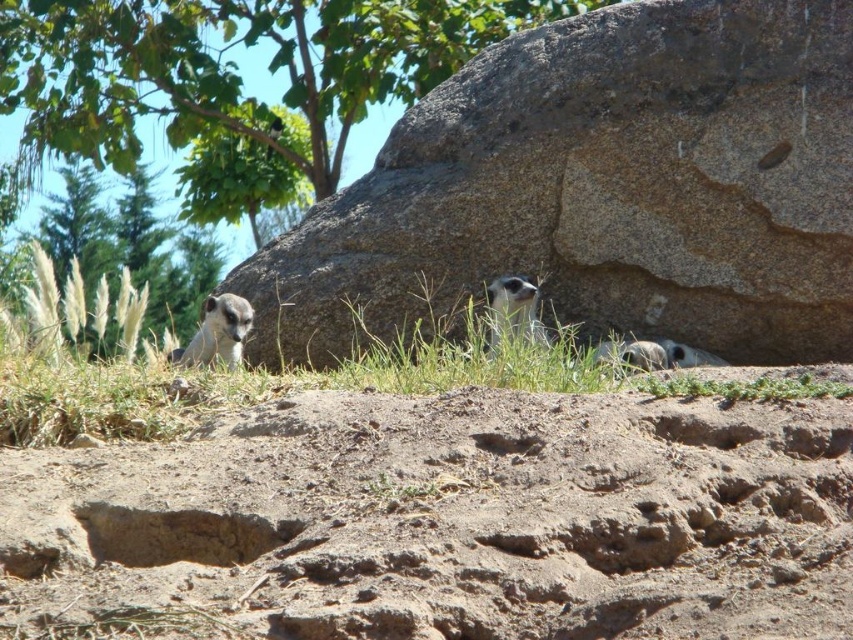
Question: Which object appears farthest from the camera in this image?

Choices:
 (A) gray rough rock at center
 (B) gray fur meerkat at left

Answer: (A)

Question: Considering the real-world distances, which object is closest to the green leafy tree at upper center?

Choices:
 (A) green leafy tree at upper left
 (B) dull brown dirt at center
 (C) green grass at center

Answer: (A)

Question: Is green leafy tree at upper center to the left of gray fur meerkat at left from the viewer's perspective?

Choices:
 (A) no
 (B) yes

Answer: (B)

Question: Which point is farther from the camera taking this photo?

Choices:
 (A) (305, 524)
 (B) (96, 256)

Answer: (B)

Question: Does green leafy tree at upper center have a lesser width compared to green grass at center?

Choices:
 (A) yes
 (B) no

Answer: (B)

Question: Does green leafy tree at upper left lie behind gray fur meerkat at center?

Choices:
 (A) no
 (B) yes

Answer: (B)